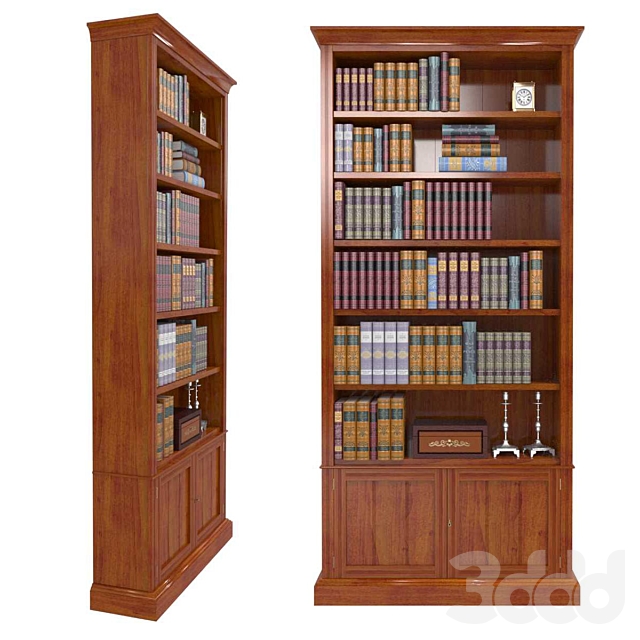
This screenshot has width=640, height=640. In order to click on visible books on shelf below top shelf of bookcase on left side in this screenshot , I will do `click(188, 148)`, `click(187, 156)`, `click(189, 164)`, `click(193, 178)`, `click(170, 148)`, `click(166, 161)`, `click(164, 164)`, `click(157, 166)`.